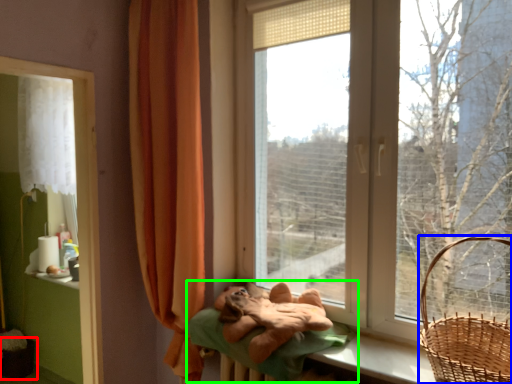
Question: Based on their relative distances, which object is nearer to basket container (highlighted by a red box)? Choose from basket (highlighted by a blue box) and bed (highlighted by a green box).

Choices:
 (A) basket
 (B) bed

Answer: (B)